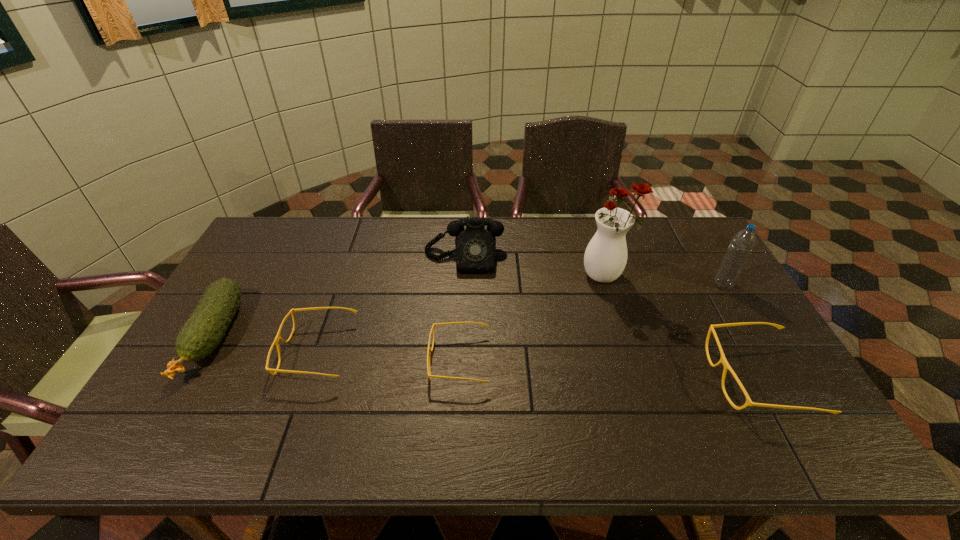
Identify the location of water bottle. This screenshot has width=960, height=540. [x=744, y=241].

Locate an element on the screen. vacant point located 0.130m in front of the lenses of the second object from left to right is located at coordinates (234, 352).

This screenshot has height=540, width=960. In order to click on vacant region located 0.130m in front of the lenses of the second object from left to right in this screenshot , I will do `click(234, 352)`.

Where is `vacant space located in front of the lenses of the second object from left to right`? This screenshot has width=960, height=540. vacant space located in front of the lenses of the second object from left to right is located at coordinates [223, 352].

I want to click on free location located 0.110m in front of the lenses of the shortest object, so click(x=388, y=360).

Identify the location of vacant space located 0.340m in front of the lenses of the shortest object. (300, 360).

Where is `free space located in front of the lenses of the shortest object`? Image resolution: width=960 pixels, height=540 pixels. free space located in front of the lenses of the shortest object is located at coordinates (406, 360).

In order to click on vacant region located in front of the lenses of the rightmost spectacles in this screenshot , I will do `click(593, 379)`.

Find the location of `vacant position located in front of the lenses of the rightmost spectacles`. vacant position located in front of the lenses of the rightmost spectacles is located at coordinates (558, 379).

Identify the location of free location located in front of the lenses of the rightmost spectacles. (593, 379).